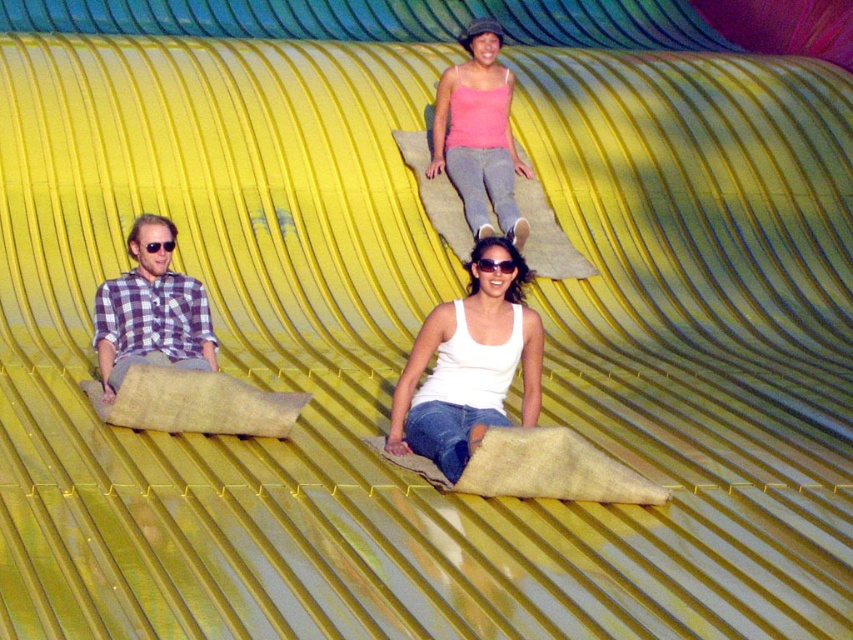
You are standing 10 meters away from the point at coordinates point (444, 474). If you walk directly towards it, will you reach it before it gets closer than 3 meters?

The distance of point (444, 474) from viewer is 13.71 meters. Since you are currently 10 meters away, you are already closer than 3 meters. Therefore, you have already passed the point where it is 3 meters away.

You are standing in front of the three people sitting on yellow plastic sheets. You want to hand a brochure to the person wearing the white matte tank top at center without disturbing the person in the plaid shirt at left. Which direction should you approach from?

You should approach from the right side of the white matte tank top at center because they are closer to you than the plaid shirt at left, allowing you to reach them without moving around the plaid shirt at left.